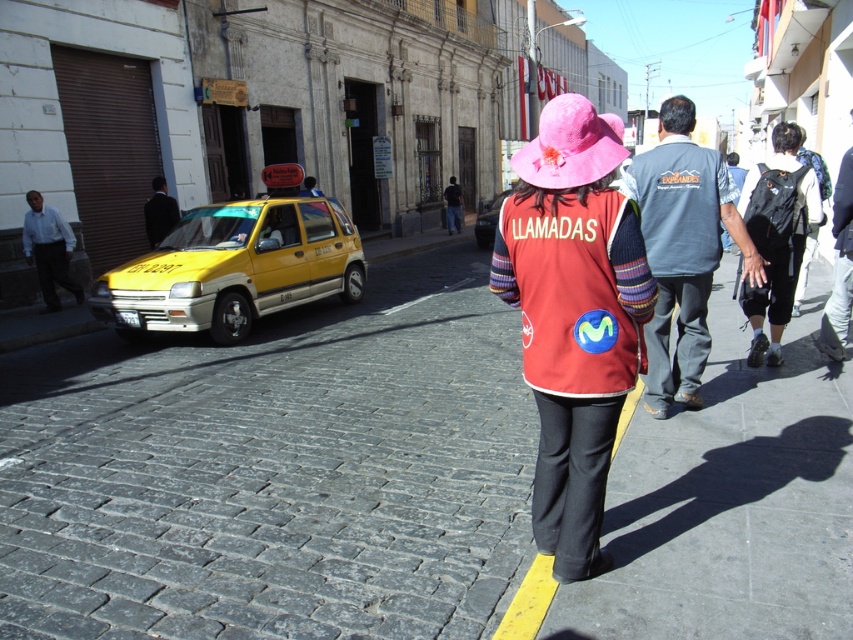
Is point (525, 148) less distant than point (515, 163)?

Yes.

Can you confirm if matte red vest at center is smaller than pink fabric hat at center?

No.

Which is in front, point (605, 460) or point (590, 118)?

Point (590, 118)

I want to click on matte red vest at center, so click(573, 317).

Based on the photo, which of these two, cobblestone pavement at center or dark blue jeans at center, stands taller?

dark blue jeans at center

Is point (410, 560) farther from camera compared to point (450, 180)?

That is False.

Which is in front, point (761, 381) or point (448, 204)?

Point (761, 381)

Where is `cobblestone pavement at center`? This screenshot has width=853, height=640. cobblestone pavement at center is located at coordinates (276, 472).

Is the position of dark suit jacket at left more distant than that of dark blue jeans at center?

No, dark suit jacket at left is in front of dark blue jeans at center.

Is dark suit jacket at left positioned in front of dark blue jeans at center?

Yes, it is in front of dark blue jeans at center.

Which is in front, point (151, 232) or point (451, 227)?

Point (151, 232) is more forward.

The image size is (853, 640). I want to click on dark suit jacket at left, so click(x=160, y=212).